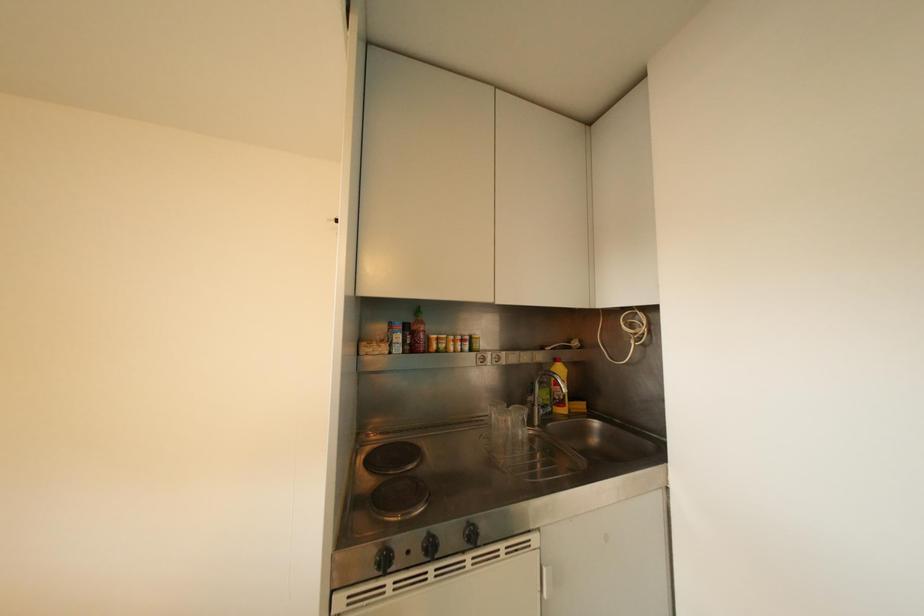
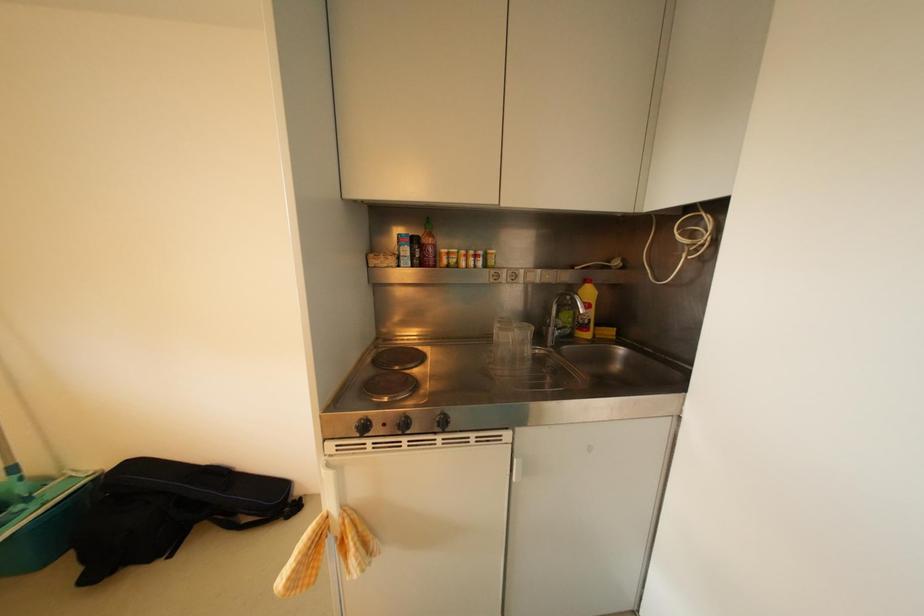
Question: Based on the continuous images, in which direction is the camera rotating? Reply with the corresponding letter.

Choices:
 (A) Left
 (B) Right
 (C) Up
 (D) Down

Answer: (D)